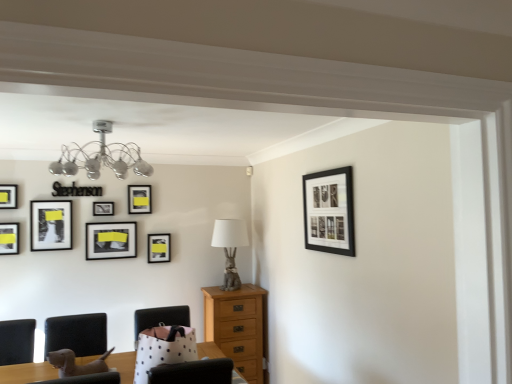
How much space does matte black picture frame at upper left, which is counted as the third picture frame, starting from the back, occupy horizontally?

1.60 inches.

Where is `matte black picture frame at upper left, which is counted as the third picture frame, starting from the back`? The width and height of the screenshot is (512, 384). matte black picture frame at upper left, which is counted as the third picture frame, starting from the back is located at coordinates (103, 208).

What do you see at coordinates (230, 248) in the screenshot? I see `gray fabric lamp at center` at bounding box center [230, 248].

Measure the distance between point (154, 254) and camera.

Point (154, 254) and camera are 12.89 feet apart.

Describe the element at coordinates (50, 225) in the screenshot. This screenshot has width=512, height=384. I see `matte black picture frame at left, marked as the 6th picture frame in a right-to-left arrangement` at that location.

The width and height of the screenshot is (512, 384). Identify the location of matte black picture frame at upper center, which appears as the 3th picture frame when viewed from the right. (139, 199).

Which is farther from the camera, (227,227) or (7,249)?

The point (227,227) is more distant.

Is gray fabric lamp at center bigger or smaller than matte black picture frame at left, which is the 2th picture frame in left-to-right order?

Clearly, gray fabric lamp at center is larger in size than matte black picture frame at left, which is the 2th picture frame in left-to-right order.

Is gray fabric lamp at center oriented away from matte black picture frame at left, which is the sixth picture frame in back-to-front order?

No, gray fabric lamp at center's orientation is not away from matte black picture frame at left, which is the sixth picture frame in back-to-front order.

From a real-world perspective, is gray fabric lamp at center located higher than matte black picture frame at left, which is the sixth picture frame in back-to-front order?

Actually, gray fabric lamp at center is physically below matte black picture frame at left, which is the sixth picture frame in back-to-front order, in the real world.

Measure the distance between white polka dot fabric armchair at center, acting as the 2th armchair starting from the left, and matte black picture frame at center-left, arranged as the 5th picture frame when viewed from the front.

white polka dot fabric armchair at center, acting as the 2th armchair starting from the left, and matte black picture frame at center-left, arranged as the 5th picture frame when viewed from the front, are 34.54 inches apart.

The image size is (512, 384). What are the coordinates of `armchair that is the 1st one when counting downward from the matte black picture frame at center-left, the 4th picture frame from the right (from the image's perspective)` in the screenshot? It's located at (160, 318).

Does white polka dot fabric armchair at center, acting as the 2th armchair starting from the left, lie in front of matte black picture frame at center-left, the 4th picture frame from the right?

Yes, white polka dot fabric armchair at center, acting as the 2th armchair starting from the left, is closer to the viewer.

Is matte black picture frame at center-left, arranged as the 5th picture frame when viewed from the front, at the back of white polka dot fabric armchair at center, acting as the 2th armchair starting from the left?

No.

From a real-world perspective, which is physically above, matte black picture frame at left, which is the sixth picture frame in back-to-front order, or light brown leather armchair at lower left, which is the first armchair in left-to-right order?

In real-world perspective, matte black picture frame at left, which is the sixth picture frame in back-to-front order, is above.

Is matte black picture frame at left, which is the sixth picture frame in back-to-front order, bigger or smaller than light brown leather armchair at lower left, which is the first armchair in left-to-right order?

matte black picture frame at left, which is the sixth picture frame in back-to-front order, is smaller than light brown leather armchair at lower left, which is the first armchair in left-to-right order.

Is the depth of matte black picture frame at left, which is counted as the third picture frame, starting from the front, less than that of light brown leather armchair at lower left, which is the 2th armchair in right-to-left order?

No.

Can you confirm if matte black picture frame at left, which is the sixth picture frame in back-to-front order, is positioned to the right of light brown leather armchair at lower left, which is the first armchair in left-to-right order?

Incorrect, matte black picture frame at left, which is the sixth picture frame in back-to-front order, is not on the right side of light brown leather armchair at lower left, which is the first armchair in left-to-right order.

Visually, is matte black picture frame at center, marked as the 1th picture frame in a back-to-front arrangement, positioned to the left or to the right of chrome metallic chandelier at upper left?

Clearly, matte black picture frame at center, marked as the 1th picture frame in a back-to-front arrangement, is on the right of chrome metallic chandelier at upper left in the image.

Does point (170, 235) come farther from viewer compared to point (124, 161)?

Yes, point (170, 235) is farther from viewer.

Is the depth of matte black picture frame at center, marked as the 1th picture frame in a back-to-front arrangement, less than that of chrome metallic chandelier at upper left?

No, the depth of matte black picture frame at center, marked as the 1th picture frame in a back-to-front arrangement, is greater than that of chrome metallic chandelier at upper left.

From the image's perspective, is matte black picture frame at center, the second picture frame in the right-to-left sequence, above or below chrome metallic chandelier at upper left?

From the image's perspective, matte black picture frame at center, the second picture frame in the right-to-left sequence, appears below chrome metallic chandelier at upper left.

Considering the positions of objects matte black picture frame at upper left, arranged as the fourth picture frame when viewed from the left, and matte black picture frame at upper left, the 2th picture frame in the front-to-back sequence, in the image provided, who is more to the left, matte black picture frame at upper left, arranged as the fourth picture frame when viewed from the left, or matte black picture frame at upper left, the 2th picture frame in the front-to-back sequence,?

matte black picture frame at upper left, the 2th picture frame in the front-to-back sequence.

Is matte black picture frame at upper left, which is counted as the third picture frame, starting from the back, in front of or behind matte black picture frame at upper left, positioned as the 8th picture frame in right-to-left order, in the image?

Result: matte black picture frame at upper left, which is counted as the third picture frame, starting from the back, is behind matte black picture frame at upper left, positioned as the 8th picture frame in right-to-left order.

Which is more distant, (x=96, y=213) or (x=3, y=191)?

The point (x=96, y=213) is farther.

Considering the sizes of objects matte black picture frame at upper left, arranged as the fifth picture frame when viewed from the right, and matte black picture frame at upper left, the 7th picture frame positioned from the back, in the image provided, who is wider, matte black picture frame at upper left, arranged as the fifth picture frame when viewed from the right, or matte black picture frame at upper left, the 7th picture frame positioned from the back,?

Wider between the two is matte black picture frame at upper left, arranged as the fifth picture frame when viewed from the right.

Does point (351, 178) come behind point (183, 317)?

No.

Is black matte picture frame at upper right, the eighth picture frame from the left, behind white polka dot fabric armchair at center, which is the 1th armchair in right-to-left order?

No, black matte picture frame at upper right, the eighth picture frame from the left, is closer to the viewer.

Does black matte picture frame at upper right, the eighth picture frame in the back-to-front sequence, have a greater height compared to white polka dot fabric armchair at center, which is the 1th armchair in right-to-left order?

Yes, black matte picture frame at upper right, the eighth picture frame in the back-to-front sequence, is taller than white polka dot fabric armchair at center, which is the 1th armchair in right-to-left order.

From the image's perspective, between matte black picture frame at left, which is the 2th picture frame in left-to-right order, and gray fabric lamp at center, which one is located above?

matte black picture frame at left, which is the 2th picture frame in left-to-right order.

How distant is matte black picture frame at left, which is counted as the third picture frame, starting from the front, from gray fabric lamp at center?

1.75 meters.

In order to click on table lamp that appears behind the matte black picture frame at left, which is the 2th picture frame in left-to-right order in this screenshot , I will do `click(230, 248)`.

Can you confirm if matte black picture frame at left, which is the seventh picture frame from right to left, is thinner than gray fabric lamp at center?

Correct, the width of matte black picture frame at left, which is the seventh picture frame from right to left, is less than that of gray fabric lamp at center.

In the image, there is a matte black picture frame at left, which is the seventh picture frame from right to left. Identify the location of table lamp below it (from a real-world perspective). This screenshot has width=512, height=384. (230, 248).

Identify the location of armchair that is the 2nd one when counting rightward from the matte black picture frame at center-left, the fifth picture frame from the left. (160, 318).

Looking at the image, which one is located further to matte black picture frame at upper left, arranged as the fourth picture frame when viewed from the left, matte black picture frame at center, acting as the 8th picture frame starting from the front, or matte black picture frame at upper left, positioned as the 8th picture frame in right-to-left order?

The object further to matte black picture frame at upper left, arranged as the fourth picture frame when viewed from the left, is matte black picture frame at upper left, positioned as the 8th picture frame in right-to-left order.

Considering their positions, is matte black picture frame at upper left, the 6th picture frame positioned from the front, positioned further to matte black picture frame at upper left, arranged as the first picture frame when viewed from the left, than chrome metallic chandelier at upper left?

Among the two, chrome metallic chandelier at upper left is located further to matte black picture frame at upper left, arranged as the first picture frame when viewed from the left.

From the image, which object appears to be nearer to gray fabric lamp at center, matte black picture frame at center, the second picture frame in the right-to-left sequence, or black matte picture frame at upper right, the first picture frame in the front-to-back sequence?

Among the two, matte black picture frame at center, the second picture frame in the right-to-left sequence, is located nearer to gray fabric lamp at center.

When comparing their distances from matte black picture frame at upper left, arranged as the fourth picture frame when viewed from the left, does gray fabric lamp at center or white polka dot fabric armchair at center, which is the 1th armchair in right-to-left order, seem further?

Based on the image, white polka dot fabric armchair at center, which is the 1th armchair in right-to-left order, appears to be further to matte black picture frame at upper left, arranged as the fourth picture frame when viewed from the left.

From the image, which object appears to be farther from light brown leather armchair at lower left, which is the 2th armchair in right-to-left order, white polka dot fabric armchair at center, acting as the 2th armchair starting from the left, or matte black picture frame at upper left, which is counted as the third picture frame, starting from the back?

The object further to light brown leather armchair at lower left, which is the 2th armchair in right-to-left order, is matte black picture frame at upper left, which is counted as the third picture frame, starting from the back.

From the image, which object appears to be nearer to chrome metallic chandelier at upper left, matte black picture frame at upper left, the 6th picture frame positioned from the front, or gray fabric lamp at center?

matte black picture frame at upper left, the 6th picture frame positioned from the front.

Considering their positions, is matte black picture frame at upper left, the 2th picture frame in the front-to-back sequence, positioned closer to light brown leather armchair at lower left, which is the 2th armchair in right-to-left order, than black matte picture frame at upper right, the eighth picture frame in the back-to-front sequence?

matte black picture frame at upper left, the 2th picture frame in the front-to-back sequence, is positioned closer to the anchor light brown leather armchair at lower left, which is the 2th armchair in right-to-left order.

Considering their positions, is white polka dot fabric armchair at center, which is the 1th armchair in right-to-left order, positioned closer to matte black picture frame at center-left, arranged as the 5th picture frame when viewed from the front, than black matte picture frame at upper right, the first picture frame in the front-to-back sequence?

white polka dot fabric armchair at center, which is the 1th armchair in right-to-left order, lies closer to matte black picture frame at center-left, arranged as the 5th picture frame when viewed from the front, than the other object.

Where is `chest of drawers between chrome metallic chandelier at upper left and matte black picture frame at center-left, the 4th picture frame from the right, in the front-back direction`? The height and width of the screenshot is (384, 512). chest of drawers between chrome metallic chandelier at upper left and matte black picture frame at center-left, the 4th picture frame from the right, in the front-back direction is located at coordinates (239, 327).

Where is `armchair positioned between light brown leather armchair at lower left, which is the 2th armchair in right-to-left order, and matte black picture frame at center, marked as the 1th picture frame in a back-to-front arrangement, from near to far`? This screenshot has height=384, width=512. armchair positioned between light brown leather armchair at lower left, which is the 2th armchair in right-to-left order, and matte black picture frame at center, marked as the 1th picture frame in a back-to-front arrangement, from near to far is located at coordinates (160, 318).

Where is `picture frame between matte black picture frame at left, which is counted as the third picture frame, starting from the front, and matte black picture frame at upper left, arranged as the fifth picture frame when viewed from the right`? picture frame between matte black picture frame at left, which is counted as the third picture frame, starting from the front, and matte black picture frame at upper left, arranged as the fifth picture frame when viewed from the right is located at coordinates (50, 225).

This screenshot has width=512, height=384. In order to click on chest of drawers between light brown leather armchair at lower left, which is the 2th armchair in right-to-left order, and gray fabric lamp at center from front to back in this screenshot , I will do `click(239, 327)`.